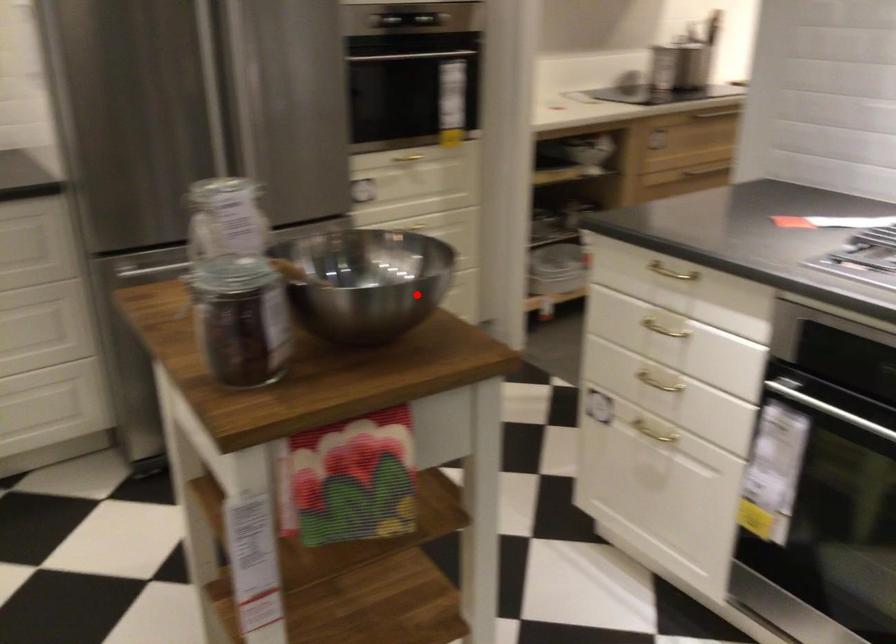
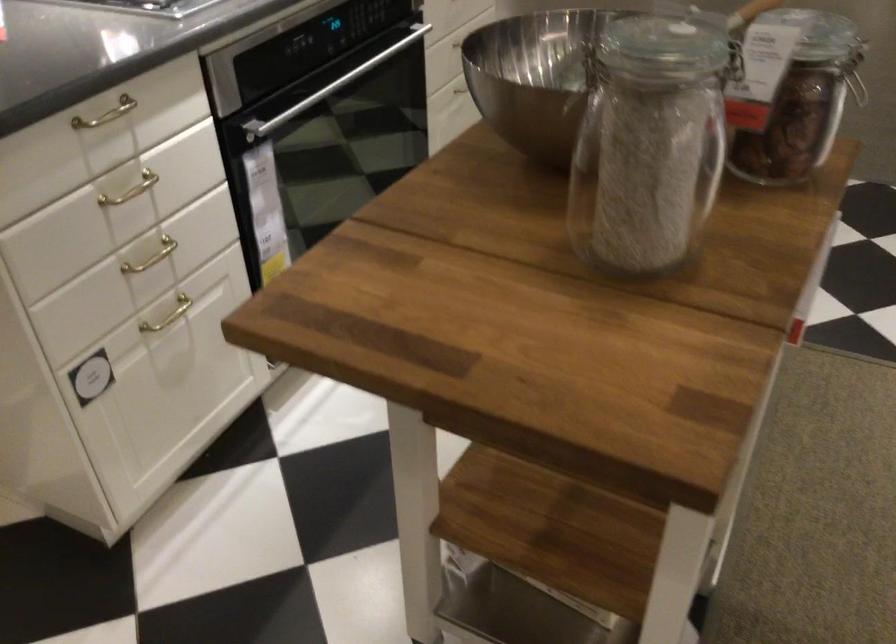
Where in the second image is the point corresponding to the highlighted location from the first image?

(535, 77)